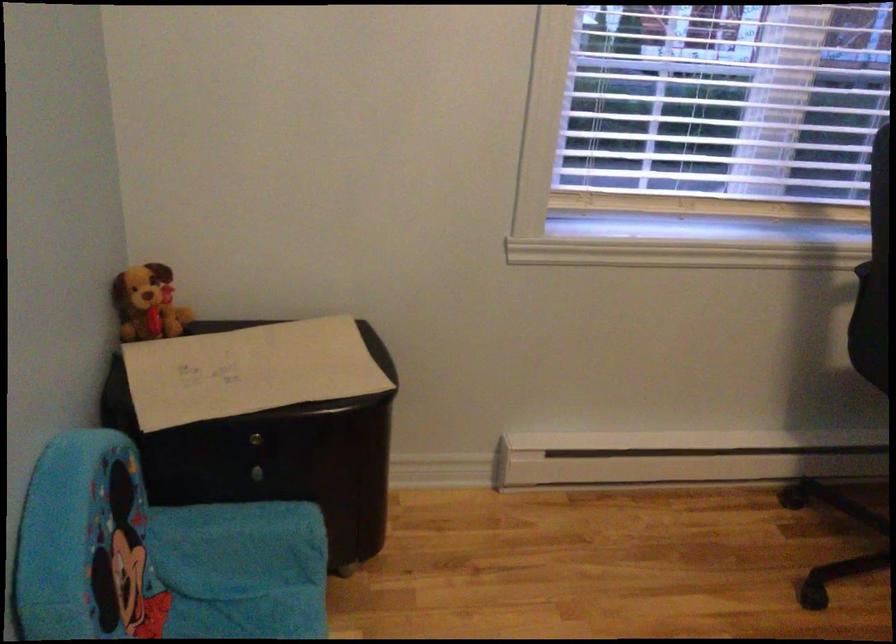
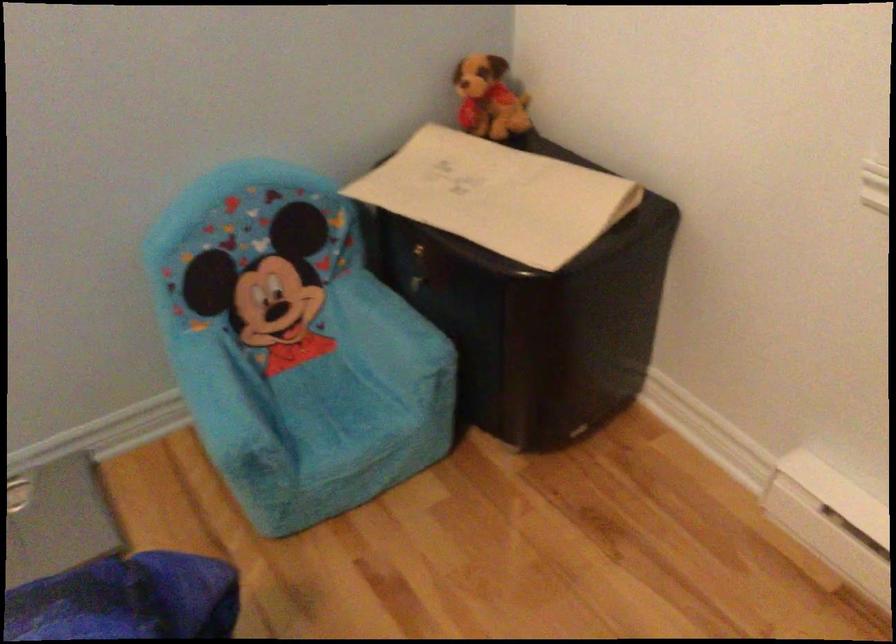
Locate, in the second image, the point that corresponds to (x=261, y=482) in the first image.

(419, 292)